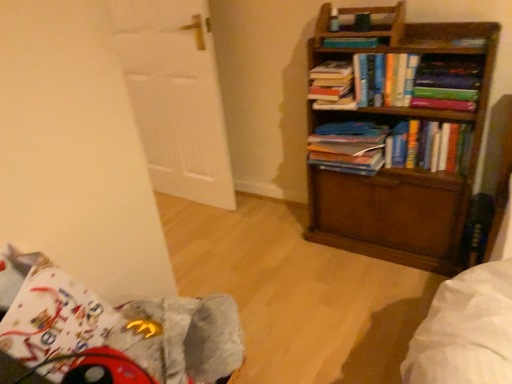
Where is `empty space that is ontop of hardcover books at center, arranged as the 5th book when viewed from the top (from a real-world perspective)`? This screenshot has width=512, height=384. empty space that is ontop of hardcover books at center, arranged as the 5th book when viewed from the top (from a real-world perspective) is located at coordinates 431,117.